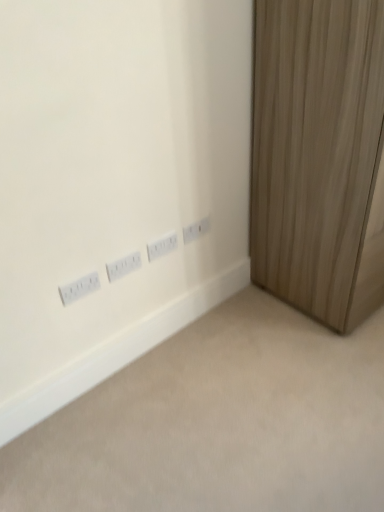
Question: Considering the relative positions of white plastic power plugs and sockets at center, which ranks as the first power plugs and sockets in right-to-left order, and white plastic power plugs and sockets at lower left, which appears as the first power plugs and sockets when viewed from the left, in the image provided, is white plastic power plugs and sockets at center, which ranks as the first power plugs and sockets in right-to-left order, to the right of white plastic power plugs and sockets at lower left, which appears as the first power plugs and sockets when viewed from the left, from the viewer's perspective?

Choices:
 (A) no
 (B) yes

Answer: (B)

Question: Does white plastic power plugs and sockets at center, the 4th power plugs and sockets in the left-to-right sequence, have a smaller size compared to white plastic power plugs and sockets at lower left, marked as the 4th power plugs and sockets in a right-to-left arrangement?

Choices:
 (A) yes
 (B) no

Answer: (A)

Question: Is white plastic power plugs and sockets at center, the 4th power plugs and sockets in the left-to-right sequence, completely or partially outside of white plastic power plugs and sockets at lower left, which appears as the first power plugs and sockets when viewed from the left?

Choices:
 (A) no
 (B) yes

Answer: (B)

Question: Can you confirm if white plastic power plugs and sockets at center, which ranks as the first power plugs and sockets in right-to-left order, is shorter than white plastic power plugs and sockets at lower left, which appears as the first power plugs and sockets when viewed from the left?

Choices:
 (A) no
 (B) yes

Answer: (B)

Question: Does white plastic power plugs and sockets at center, which ranks as the first power plugs and sockets in right-to-left order, have a larger size compared to white plastic power plugs and sockets at lower left, marked as the 4th power plugs and sockets in a right-to-left arrangement?

Choices:
 (A) yes
 (B) no

Answer: (B)

Question: Does white plastic power plugs and sockets at center, which ranks as the first power plugs and sockets in right-to-left order, turn towards white plastic power plugs and sockets at lower left, marked as the 4th power plugs and sockets in a right-to-left arrangement?

Choices:
 (A) yes
 (B) no

Answer: (B)

Question: Is white plastic power plugs and sockets at center, the 3th power plugs and sockets viewed from the right, smaller than wooden curtain at right?

Choices:
 (A) yes
 (B) no

Answer: (A)

Question: From a real-world perspective, is white plastic power plugs and sockets at center, marked as the 2th power plugs and sockets in a left-to-right arrangement, beneath wooden curtain at right?

Choices:
 (A) no
 (B) yes

Answer: (B)

Question: Can you confirm if white plastic power plugs and sockets at center, the 3th power plugs and sockets viewed from the right, is bigger than wooden curtain at right?

Choices:
 (A) no
 (B) yes

Answer: (A)

Question: From the image's perspective, would you say white plastic power plugs and sockets at center, marked as the 2th power plugs and sockets in a left-to-right arrangement, is shown under wooden curtain at right?

Choices:
 (A) no
 (B) yes

Answer: (B)

Question: From a real-world perspective, is white plastic power plugs and sockets at center, marked as the 2th power plugs and sockets in a left-to-right arrangement, over wooden curtain at right?

Choices:
 (A) yes
 (B) no

Answer: (B)

Question: Is white plastic power plugs and sockets at center, marked as the 2th power plugs and sockets in a left-to-right arrangement, not near wooden curtain at right?

Choices:
 (A) no
 (B) yes

Answer: (A)

Question: Is the position of white plastic power plugs and sockets at lower left, which appears as the first power plugs and sockets when viewed from the left, less distant than that of white plastic power plugs and sockets at center, marked as the 2th power plugs and sockets in a left-to-right arrangement?

Choices:
 (A) yes
 (B) no

Answer: (A)